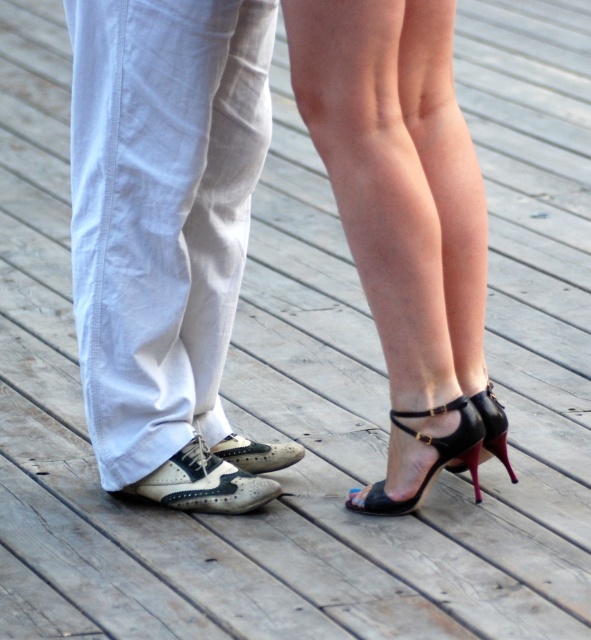
Question: Among these objects, which one is nearest to the camera?

Choices:
 (A) white leather wingtip shoe at left
 (B) white linen pants at center
 (C) black leather high heels at center

Answer: (B)

Question: Does leather high-heeled shoes at center come in front of white leather wingtip shoe at left?

Choices:
 (A) no
 (B) yes

Answer: (B)

Question: Among these points, which one is nearest to the camera?

Choices:
 (A) (402, 500)
 (B) (139, 208)

Answer: (B)

Question: Does black patent leather high heels at center have a lesser width compared to black leather sandal at lower right?

Choices:
 (A) yes
 (B) no

Answer: (B)

Question: Which of these objects is positioned farthest from the black leather high heels at center?

Choices:
 (A) white leather wingtip shoe at left
 (B) leather high-heeled shoes at center

Answer: (A)

Question: In this image, where is black patent leather high heels at center located relative to white leather wingtip shoe at left?

Choices:
 (A) right
 (B) left

Answer: (A)